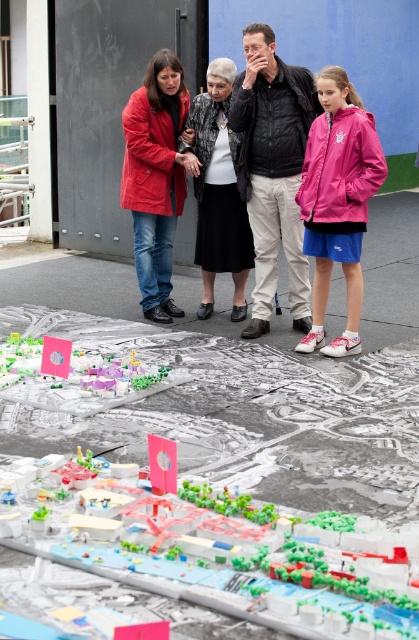
You are an architect reviewing the city model. You notice the plastic building at center and black matte skirt at center. Which object is wider?

The plastic building at center is wider than the black matte skirt at center.

You are standing in front of the city model and want to move from point A to point B. Point A is at coordinate point (136, 220) and point B is at coordinate point (136, 364). According to the description, which point is closer to you?

Point A at coordinate point (136, 220) is closer to you because it is further to the viewer than point B at coordinate point (136, 364).

You are standing in front of the city model and want to move from the point at coordinates point [312,147] to the point at coordinates point [131,134]. Which direction should you move?

You should move backward because point [312,147] is in front of point [131,134], so moving backward will take you towards the latter.